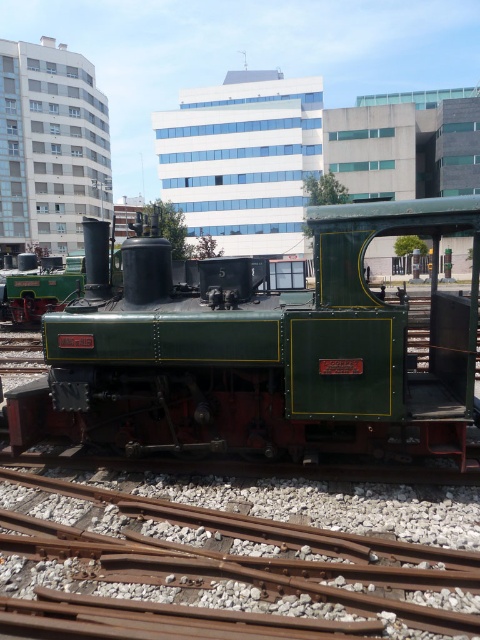
Can you confirm if green matte train at center is bigger than rusty metal train track at lower center?

Yes.

Who is taller, green matte train at center or rusty metal train track at lower center?

Standing taller between the two is green matte train at center.

Which is behind, point (67, 417) or point (165, 502)?

Positioned behind is point (67, 417).

Locate an element on the screen. green matte train at center is located at coordinates (259, 349).